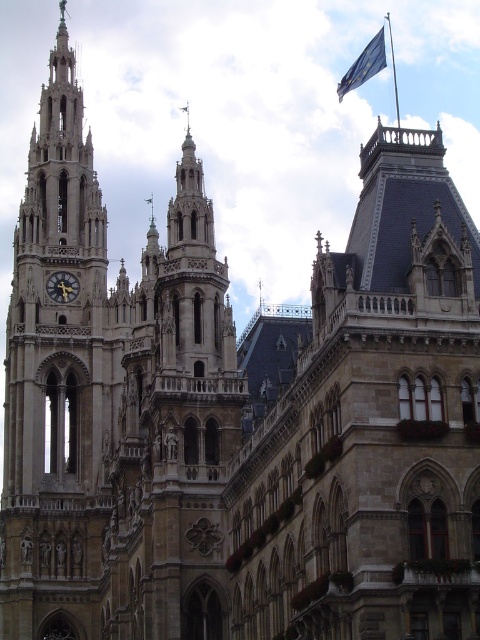
Does stone gothic tower at center appear on the right side of blue fabric flag at upper right?

Incorrect, stone gothic tower at center is not on the right side of blue fabric flag at upper right.

Describe the element at coordinates (173, 429) in the screenshot. The width and height of the screenshot is (480, 640). I see `stone gothic tower at center` at that location.

Find the location of a particular element. The image size is (480, 640). stone gothic tower at center is located at coordinates (173, 429).

Can you confirm if gold metallic clock at center-left is wider than metallic flag pole at upper center?

Yes.

Is point (76, 291) closer to viewer compared to point (394, 76)?

That is True.

Find the location of a particular element. gold metallic clock at center-left is located at coordinates (62, 285).

Between stone clock tower at left and gold metallic clock at center-left, which one appears on the right side from the viewer's perspective?

stone clock tower at left is more to the right.

Is stone clock tower at left smaller than gold metallic clock at center-left?

No.

Between point (74, 221) and point (55, 298), which one is positioned in front?

Positioned in front is point (55, 298).

This screenshot has height=640, width=480. Identify the location of stone clock tower at left. (58, 380).